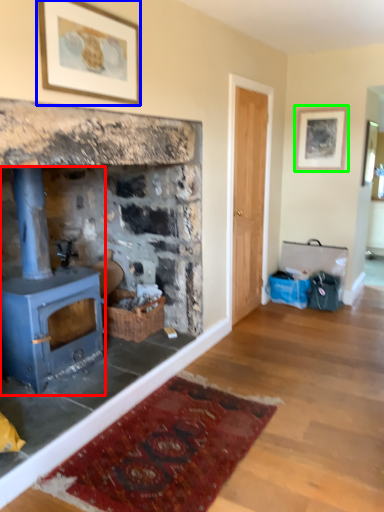
Question: Estimate the real-world distances between objects in this image. Which object is farther from wood burning stove (highlighted by a red box), picture frame (highlighted by a blue box) or picture frame (highlighted by a green box)?

Choices:
 (A) picture frame
 (B) picture frame

Answer: (B)